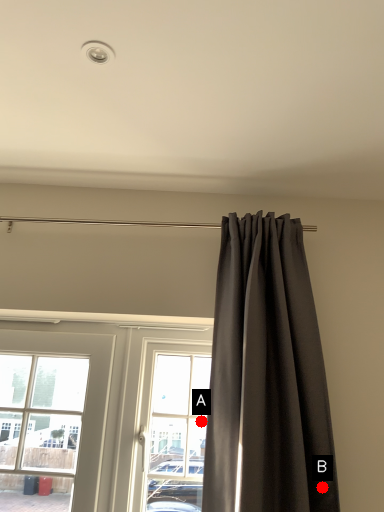
Question: Two points are circled on the image, labeled by A and B beside each circle. Which point is closer to the camera taking this photo?

Choices:
 (A) A is closer
 (B) B is closer

Answer: (B)